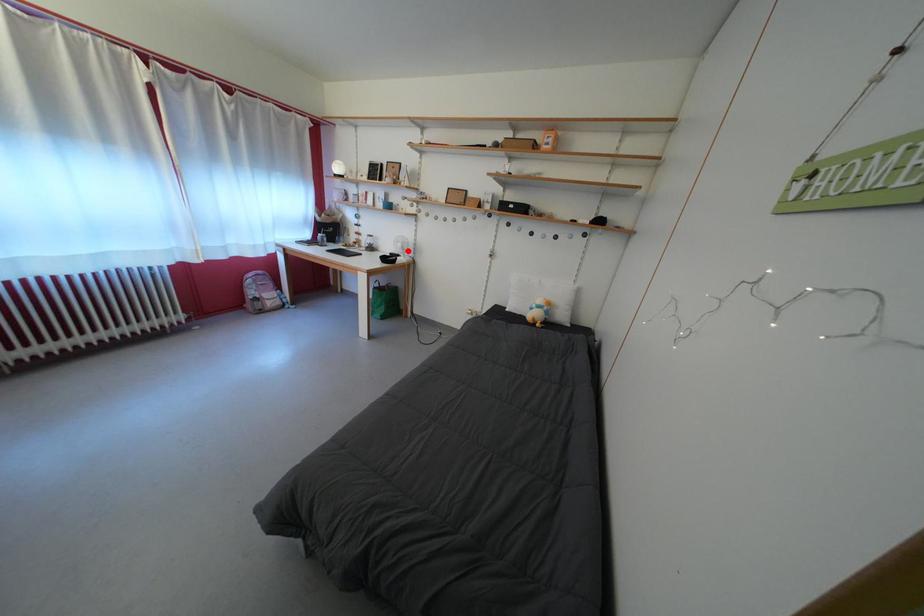
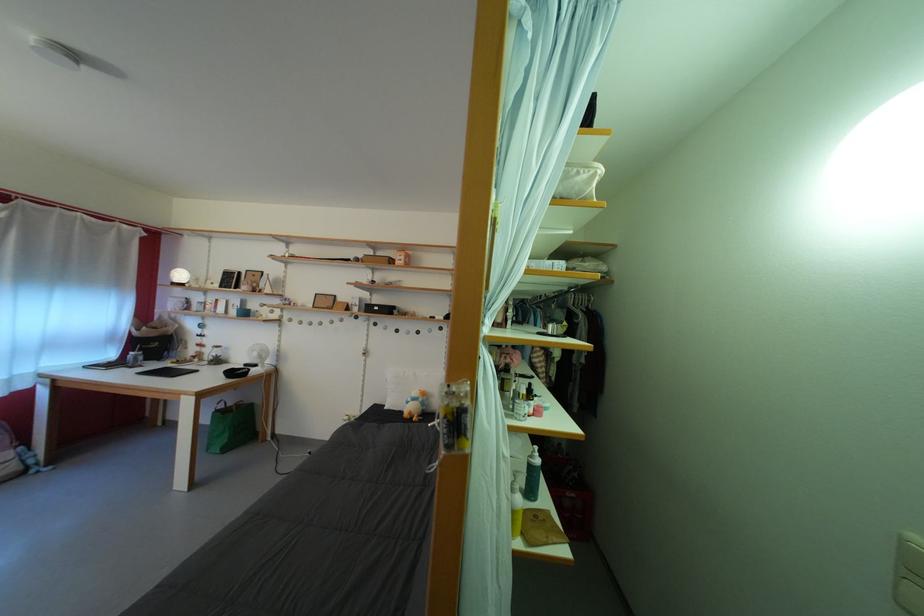
Locate, in the second image, the point that corresponds to the highlighted location in the first image.

(263, 360)